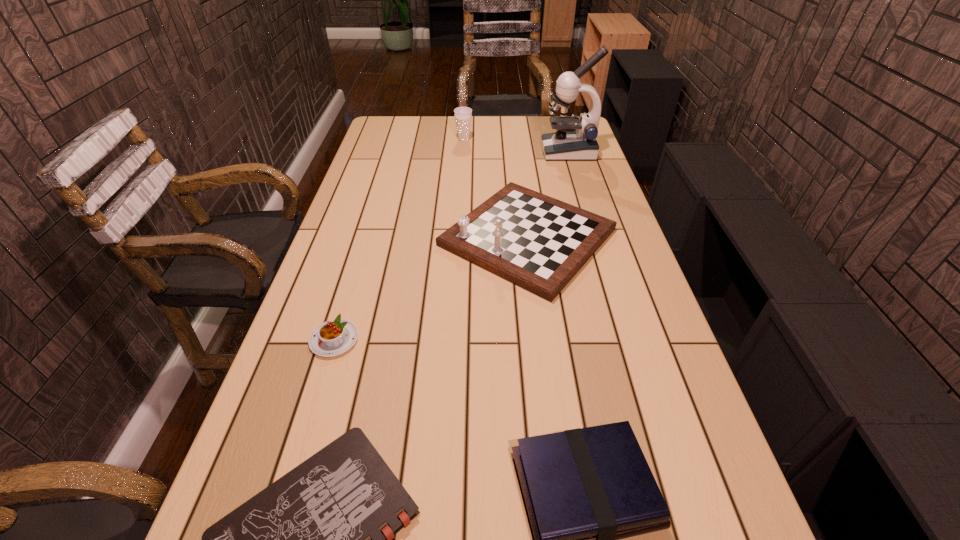
Identify which object is the closest to the second shortest object. Please provide its 2D coordinates. Your answer should be formatted as a tuple, i.e. [(x, y)], where the tuple contains the x and y coordinates of a point satisfying the conditions above.

[(539, 243)]

At what (x,y) coordinates should I click in order to perform the action: click on the third closest object to the notebook. Please return your answer as a coordinate pair (x, y). Looking at the image, I should click on (539, 243).

The image size is (960, 540). I want to click on free space that satisfies the following two spatial constraints: 1. on the back side of the gameboard; 2. on the left side of the tallest object, so click(x=516, y=152).